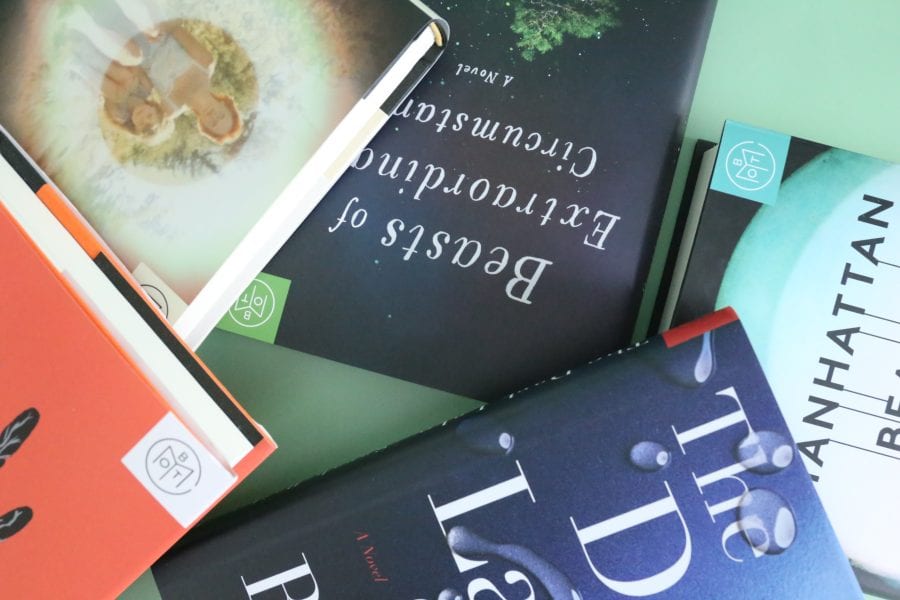
Find the location of a particular element. This screenshot has height=600, width=900. orange book is located at coordinates (45, 391).